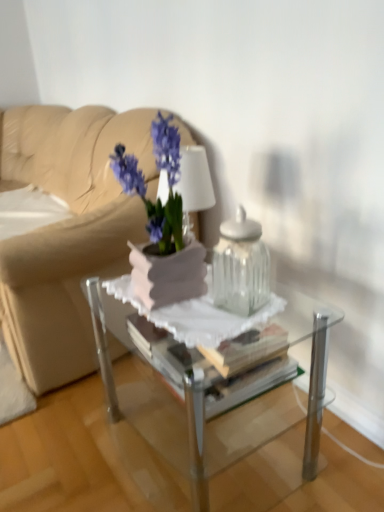
Question: Considering the relative positions of matte white vase at center and clear glass jar at center in the image provided, is matte white vase at center to the left of clear glass jar at center from the viewer's perspective?

Choices:
 (A) no
 (B) yes

Answer: (B)

Question: Is matte white vase at center next to clear glass jar at center and touching it?

Choices:
 (A) yes
 (B) no

Answer: (B)

Question: Considering the relative sizes of matte white vase at center and clear glass jar at center in the image provided, is matte white vase at center shorter than clear glass jar at center?

Choices:
 (A) yes
 (B) no

Answer: (B)

Question: Is matte white vase at center wider than clear glass jar at center?

Choices:
 (A) yes
 (B) no

Answer: (A)

Question: Is matte white vase at center further to the viewer compared to clear glass jar at center?

Choices:
 (A) yes
 (B) no

Answer: (B)

Question: Looking at their shapes, would you say clear glass jar at center is wider or thinner than matte white vase at center?

Choices:
 (A) thin
 (B) wide

Answer: (A)

Question: Is point (235, 268) positioned closer to the camera than point (135, 181)?

Choices:
 (A) closer
 (B) farther

Answer: (B)

Question: Considering the positions of clear glass jar at center and matte white vase at center in the image, is clear glass jar at center bigger or smaller than matte white vase at center?

Choices:
 (A) big
 (B) small

Answer: (B)

Question: From their relative heights in the image, would you say clear glass jar at center is taller or shorter than matte white vase at center?

Choices:
 (A) short
 (B) tall

Answer: (A)

Question: Is clear glass table at center inside or outside of clear glass jar at center?

Choices:
 (A) outside
 (B) inside

Answer: (A)

Question: Based on their sizes in the image, would you say clear glass table at center is bigger or smaller than clear glass jar at center?

Choices:
 (A) small
 (B) big

Answer: (B)

Question: Considering their positions, is clear glass table at center located in front of or behind clear glass jar at center?

Choices:
 (A) front
 (B) behind

Answer: (A)

Question: From the image's perspective, is clear glass table at center positioned above or below clear glass jar at center?

Choices:
 (A) below
 (B) above

Answer: (A)

Question: Considering the positions of beige leather couch at upper left and clear glass jar at center in the image, is beige leather couch at upper left wider or thinner than clear glass jar at center?

Choices:
 (A) wide
 (B) thin

Answer: (A)

Question: Is beige leather couch at upper left in front of or behind clear glass jar at center in the image?

Choices:
 (A) front
 (B) behind

Answer: (B)